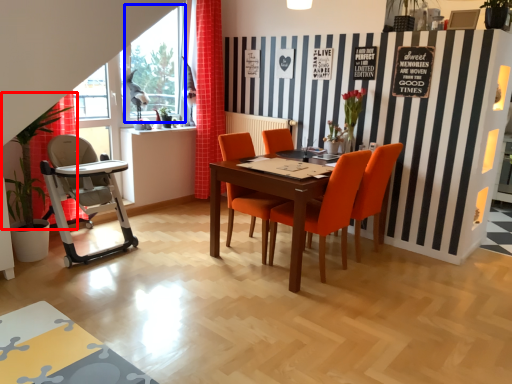
Question: Which point is closer to the camera, plant (highlighted by a red box) or window screen (highlighted by a blue box)?

Choices:
 (A) plant
 (B) window screen

Answer: (A)